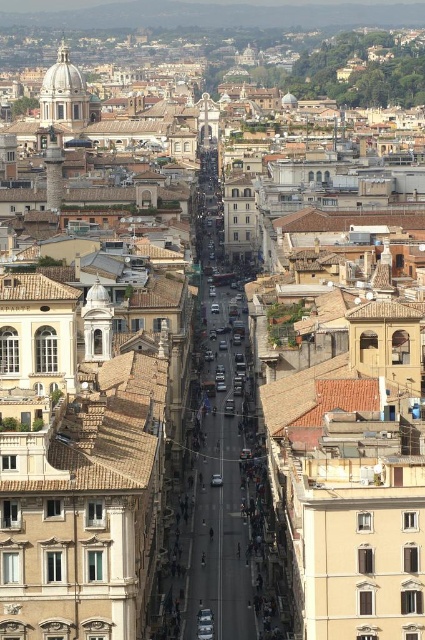
Question: Does matte white dome at upper left have a larger size compared to silver metallic car at center?

Choices:
 (A) yes
 (B) no

Answer: (A)

Question: Among these objects, which one is farthest from the camera?

Choices:
 (A) matte white dome at upper left
 (B) silver metallic car at center

Answer: (A)

Question: Is matte white dome at upper left wider than silver metallic car at center?

Choices:
 (A) no
 (B) yes

Answer: (B)

Question: Which of the following is the closest to the observer?

Choices:
 (A) silver metallic car at center
 (B) matte white dome at upper left

Answer: (A)

Question: Is matte white dome at upper left thinner than silver metallic car at center?

Choices:
 (A) no
 (B) yes

Answer: (A)